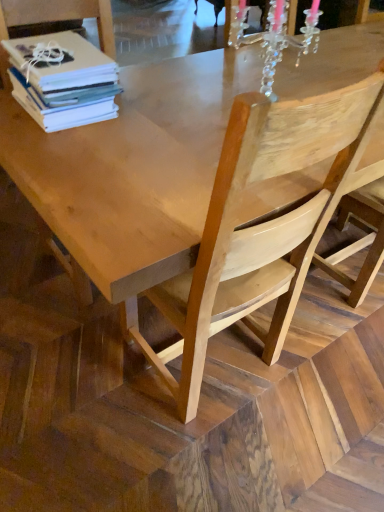
Locate an element on the screen. free spot behind clear crystal chandelier at upper center is located at coordinates (247, 78).